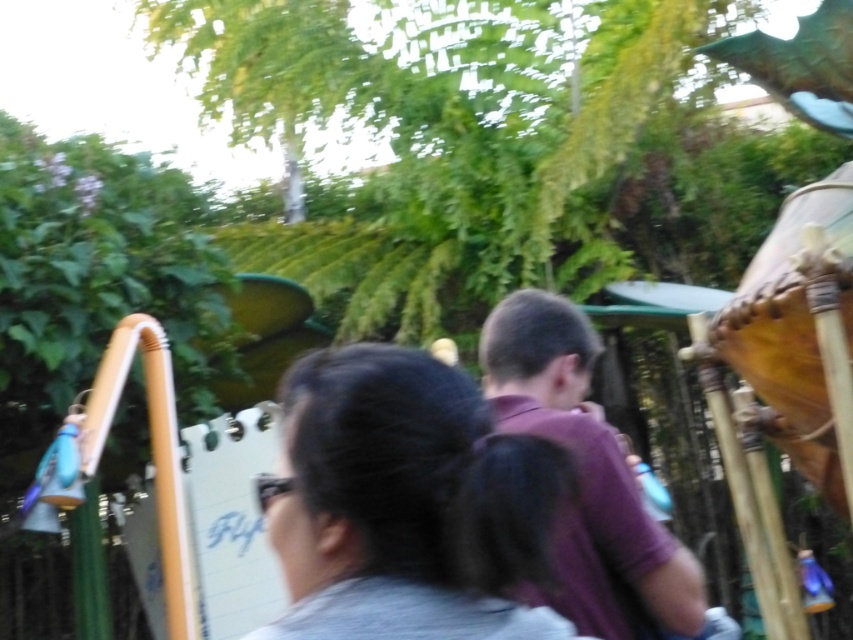
Based on the photo, you are a photographer trying to capture a photo of the gray matte hair at center and the purple matte shirt at center in the amusement park scene. Based on their positions, which object would appear shorter in your photo?

The gray matte hair at center appears shorter in the photo because it has a lesser height compared to the purple matte shirt at center.

You are standing at the point marked as point [405,502]. What object is located at this point?

The gray matte hair at center is located at point [405,502].